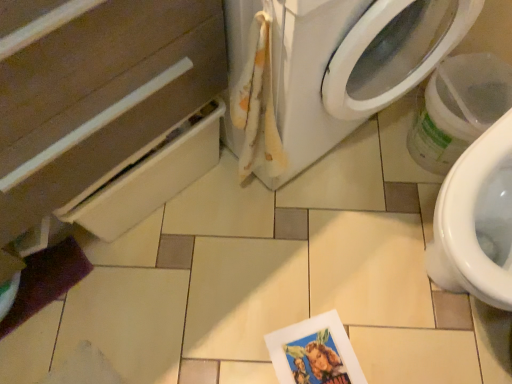
Question: Are matte white drawer at lower left and white fabric washing machine at center far apart?

Choices:
 (A) yes
 (B) no

Answer: (B)

Question: From a real-world perspective, is matte white drawer at lower left below white fabric washing machine at center?

Choices:
 (A) no
 (B) yes

Answer: (A)

Question: Is matte white drawer at lower left oriented towards white fabric washing machine at center?

Choices:
 (A) yes
 (B) no

Answer: (B)

Question: From a real-world perspective, is matte white drawer at lower left positioned over white fabric washing machine at center based on gravity?

Choices:
 (A) no
 (B) yes

Answer: (B)

Question: Does matte white drawer at lower left have a smaller size compared to white fabric washing machine at center?

Choices:
 (A) yes
 (B) no

Answer: (A)

Question: From a real-world perspective, is white fabric washing machine at center above or below fluffy white towel at upper center?

Choices:
 (A) below
 (B) above

Answer: (A)

Question: Considering the positions of white fabric washing machine at center and fluffy white towel at upper center in the image, is white fabric washing machine at center wider or thinner than fluffy white towel at upper center?

Choices:
 (A) thin
 (B) wide

Answer: (B)

Question: Based on their sizes in the image, would you say white fabric washing machine at center is bigger or smaller than fluffy white towel at upper center?

Choices:
 (A) big
 (B) small

Answer: (A)

Question: Considering the relative positions of white fabric washing machine at center and fluffy white towel at upper center in the image provided, is white fabric washing machine at center to the left or to the right of fluffy white towel at upper center?

Choices:
 (A) right
 (B) left

Answer: (A)

Question: Looking at the image, does printed paper postcard at lower center seem bigger or smaller compared to fluffy white towel at upper center?

Choices:
 (A) small
 (B) big

Answer: (A)

Question: Does point pyautogui.click(x=328, y=337) appear closer or farther from the camera than point pyautogui.click(x=245, y=119)?

Choices:
 (A) closer
 (B) farther

Answer: (B)

Question: Is printed paper postcard at lower center wider or thinner than fluffy white towel at upper center?

Choices:
 (A) wide
 (B) thin

Answer: (A)

Question: Is printed paper postcard at lower center situated inside fluffy white towel at upper center or outside?

Choices:
 (A) inside
 (B) outside

Answer: (B)

Question: In terms of width, does white fabric washing machine at center look wider or thinner when compared to printed paper postcard at lower center?

Choices:
 (A) wide
 (B) thin

Answer: (A)

Question: Is white fabric washing machine at center inside or outside of printed paper postcard at lower center?

Choices:
 (A) inside
 (B) outside

Answer: (B)